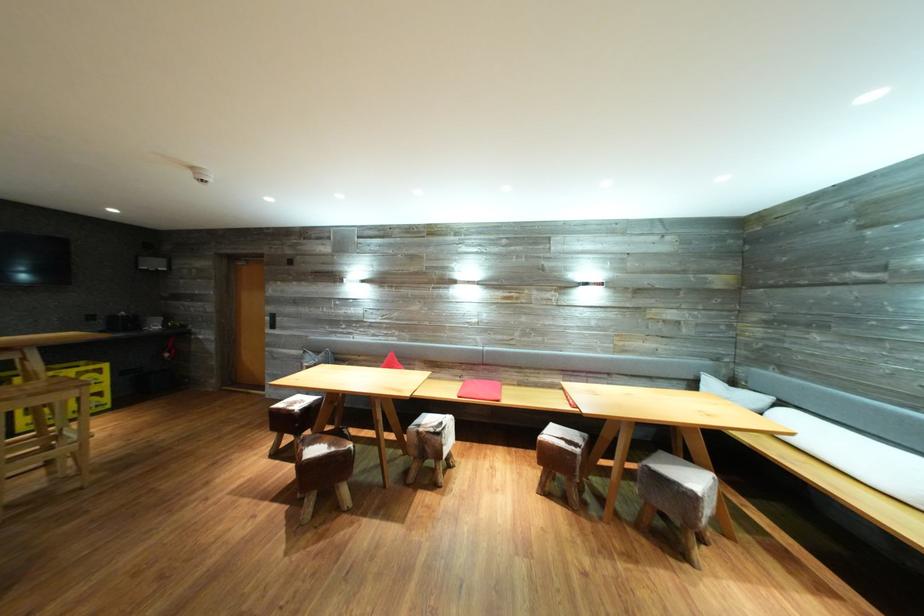
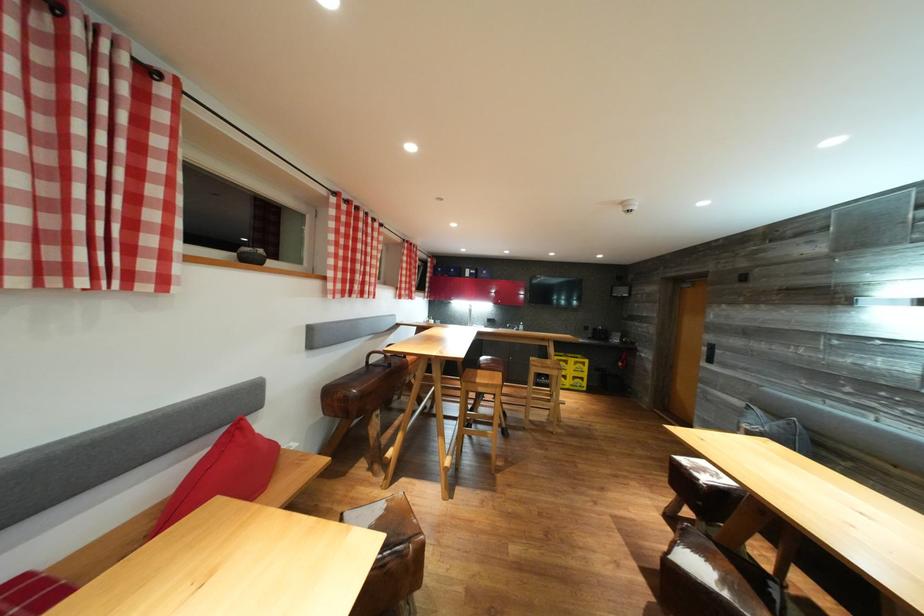
Where in the second image is the point corresponding to the point at 312,370 from the first image?

(751, 431)